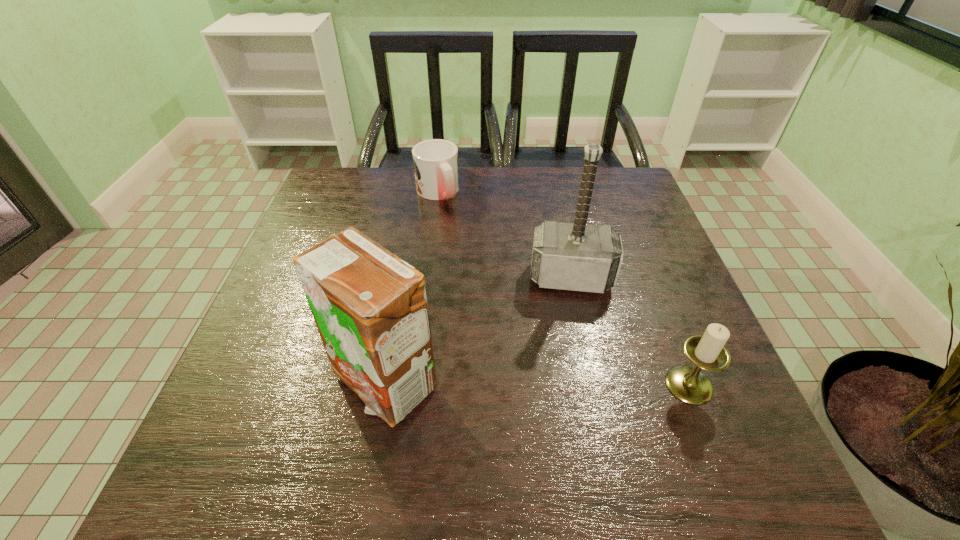
Where is `vacant spot on the desktop that is between the carton and the rightmost object and is positioned for striking with the head of the hammer`? The image size is (960, 540). vacant spot on the desktop that is between the carton and the rightmost object and is positioned for striking with the head of the hammer is located at coordinates (573, 384).

Where is `vacant space on the desktop that is between the carton and the rightmost object and is positioned on the side of the farthest object with the handle`? vacant space on the desktop that is between the carton and the rightmost object and is positioned on the side of the farthest object with the handle is located at coordinates (569, 384).